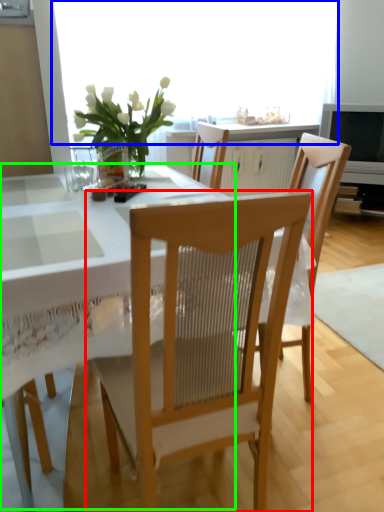
Question: Which object is positioned farthest from chair (highlighted by a red box)? Select from window screen (highlighted by a blue box) and table (highlighted by a green box).

Choices:
 (A) window screen
 (B) table

Answer: (A)